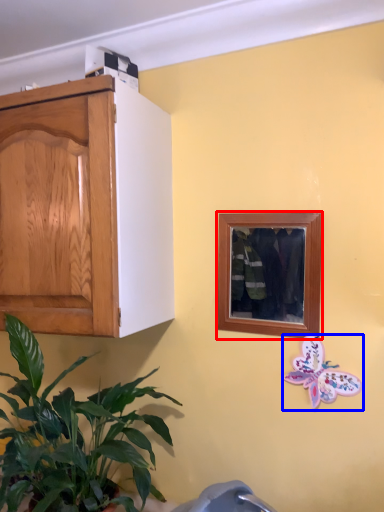
Question: Which object appears farthest to the camera in this image, picture frame (highlighted by a red box) or butterfly (highlighted by a blue box)?

Choices:
 (A) picture frame
 (B) butterfly

Answer: (A)